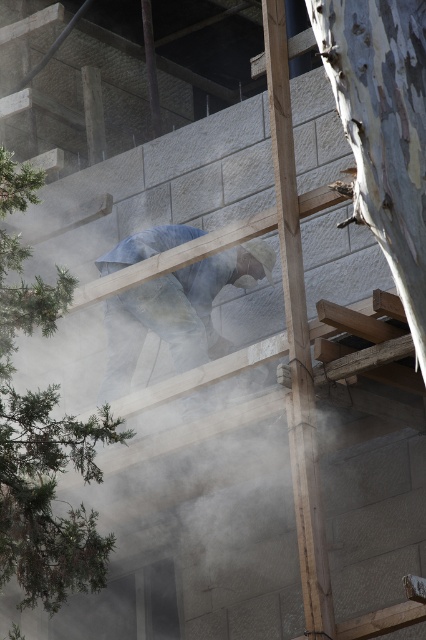
Question: Which point is farther from the camera taking this photo?

Choices:
 (A) (123, 252)
 (B) (305, 442)

Answer: (A)

Question: Which object is closer to the camera taking this photo?

Choices:
 (A) smooth wood beam at center
 (B) blue denim jeans at center

Answer: (A)

Question: Which of the following is the farthest from the observer?

Choices:
 (A) (307, 438)
 (B) (118, 381)

Answer: (B)

Question: Is smooth wood beam at center wider than blue denim jeans at center?

Choices:
 (A) yes
 (B) no

Answer: (B)

Question: Can you confirm if smooth wood beam at center is positioned above blue denim jeans at center?

Choices:
 (A) yes
 (B) no

Answer: (B)

Question: Observing the image, what is the correct spatial positioning of smooth wood beam at center in reference to blue denim jeans at center?

Choices:
 (A) above
 (B) below

Answer: (B)